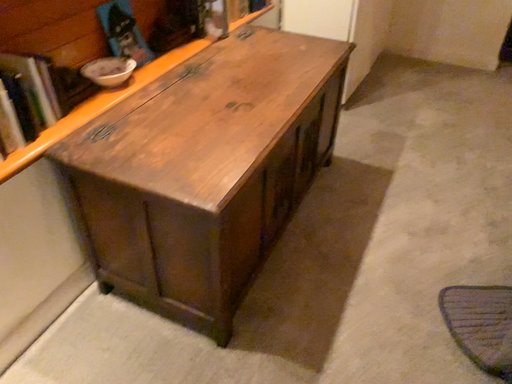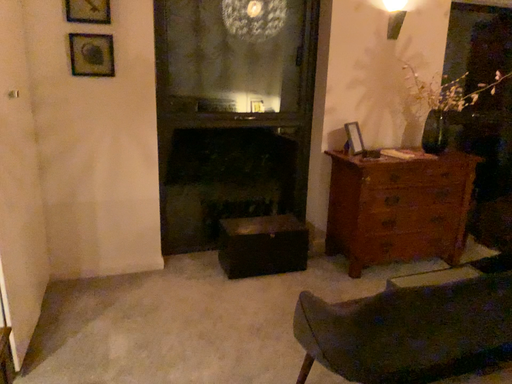
Question: How did the camera likely rotate when shooting the video?

Choices:
 (A) rotated upward
 (B) rotated downward

Answer: (A)